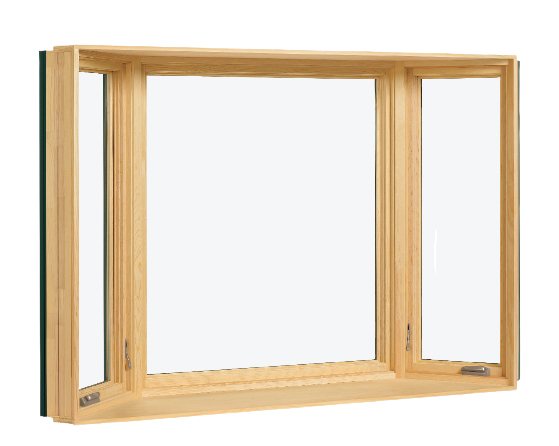
Find the location of a particular element. The height and width of the screenshot is (446, 559). top of window is located at coordinates (282, 55).